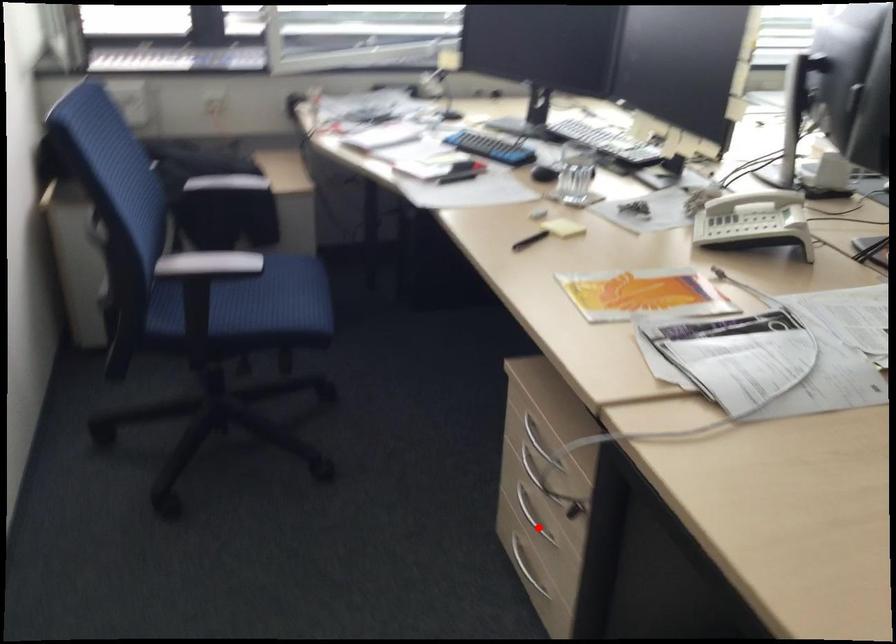
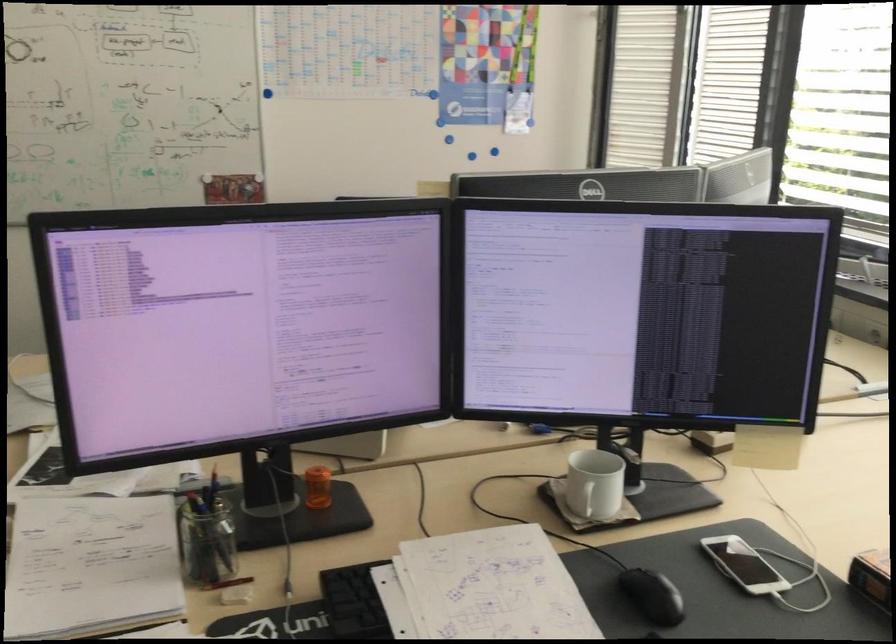
Question: I am providing you with two images of the same scene from different viewpoints. A red point is marked on the first image. At the location where the point appears in image 1, is it still visible in image 2?

Choices:
 (A) Yes
 (B) No

Answer: (B)